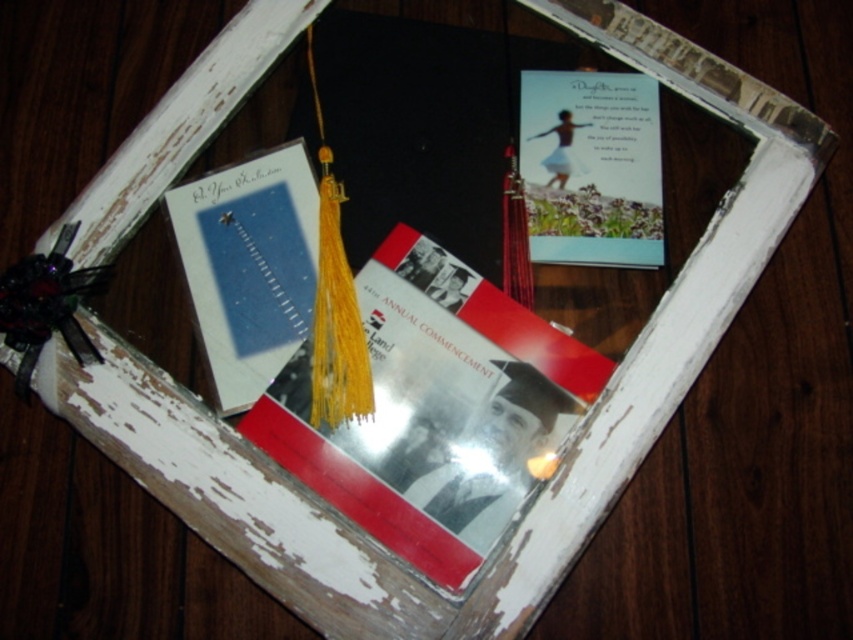
You are organizing a graduation display and need to place a new item between the white paper card at left and the black silky tassel at lower left. Which object should you place closer to the back of the display case?

The black silky tassel at lower left should be placed closer to the back of the display case because the white paper card at left is further to the viewer, meaning the tassel is positioned behind it.

What is located at the coordinates point (248, 266) in the display case?

At point (248, 266) lies the white paper card at left.